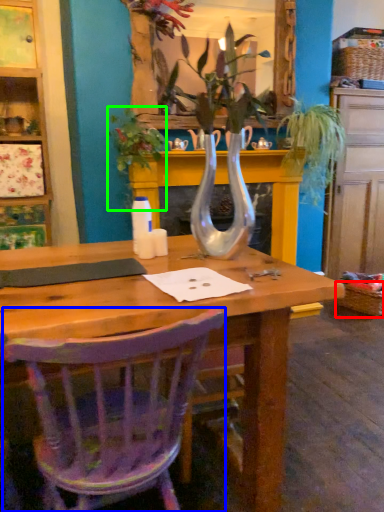
Question: Which is nearer to the picnic basket (highlighted by a red box)? chair (highlighted by a blue box) or plant (highlighted by a green box).

Choices:
 (A) chair
 (B) plant

Answer: (B)